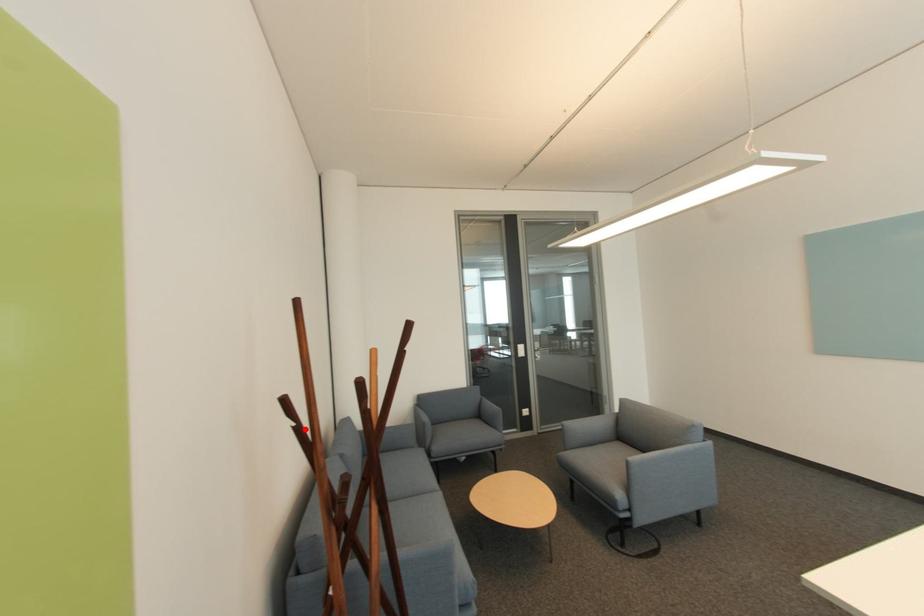
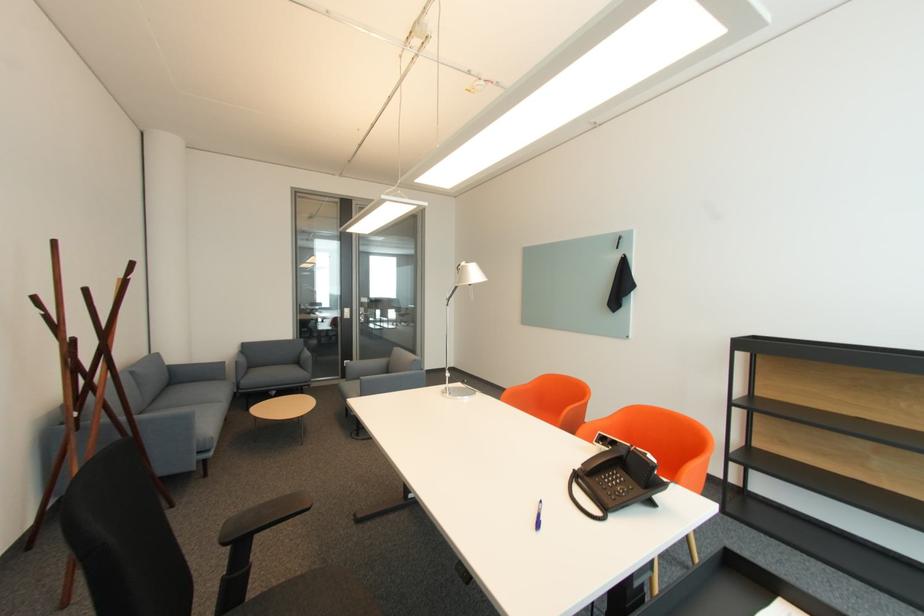
Where in the second image is the point corresponding to the highlighted location from the first image?

(53, 315)